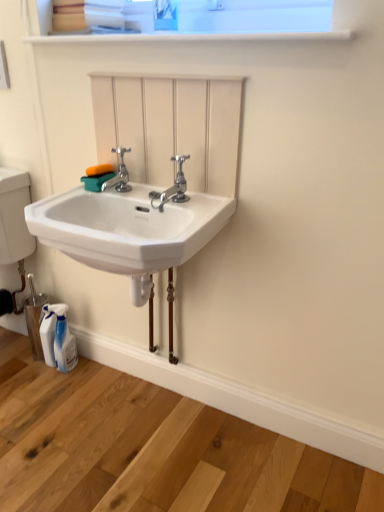
This screenshot has width=384, height=512. Identify the location of vacant space to the right of chrome metallic faucet at center, acting as the first tap starting from the left. (158, 197).